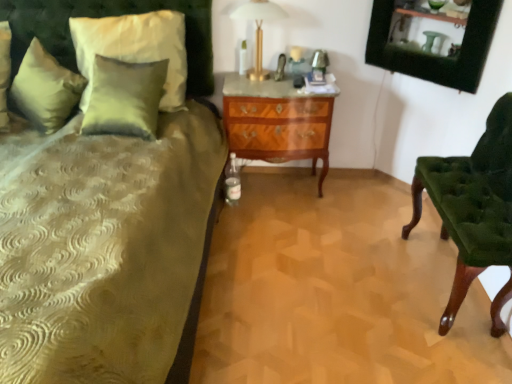
The width and height of the screenshot is (512, 384). Find the location of `free location in front of gold metallic table lamp at upper center`. free location in front of gold metallic table lamp at upper center is located at coordinates (260, 87).